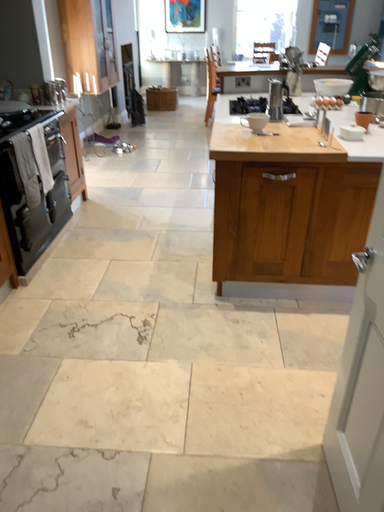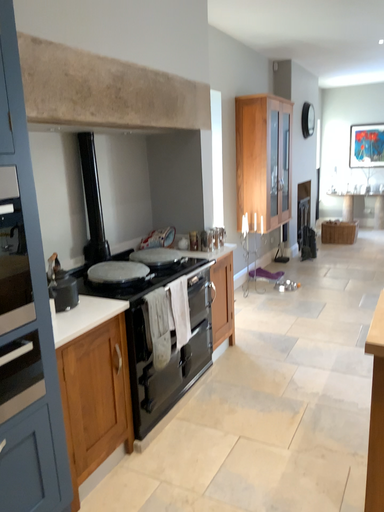
Question: Which way did the camera rotate in the video?

Choices:
 (A) rotated upward
 (B) rotated downward

Answer: (A)